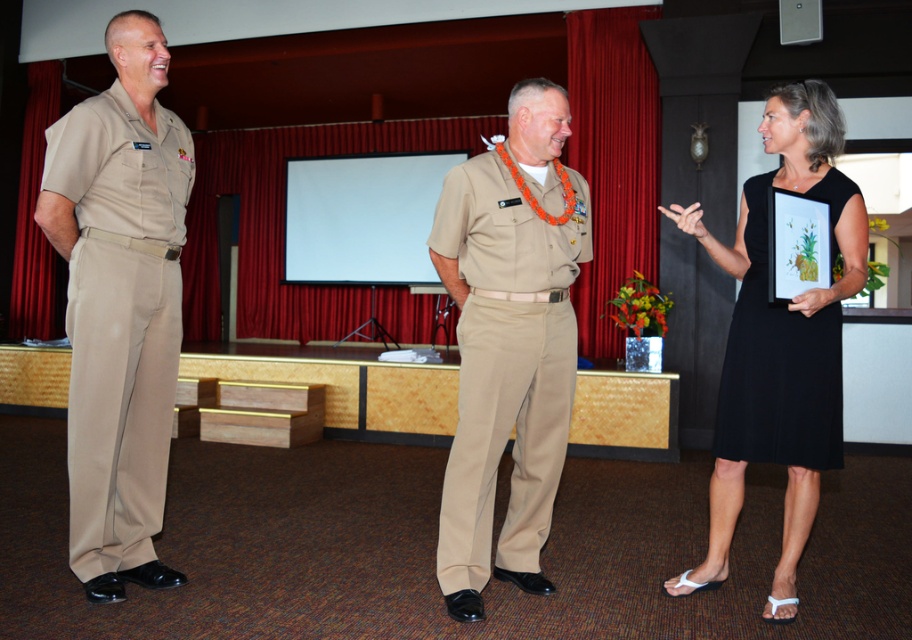
Question: Does tan cotton pants at left appear over black satin dress at right?

Choices:
 (A) yes
 (B) no

Answer: (B)

Question: Based on their relative distances, which object is nearer to the black fabric dress at upper right?

Choices:
 (A) tan/khaki uniform at center
 (B) tan cotton pants at left

Answer: (A)

Question: Does tan cotton pants at left appear under black fabric dress at upper right?

Choices:
 (A) no
 (B) yes

Answer: (A)

Question: Can you confirm if tan cotton pants at left is bigger than black fabric dress at upper right?

Choices:
 (A) yes
 (B) no

Answer: (B)

Question: Which object is farther from the camera taking this photo?

Choices:
 (A) tan/khaki uniform at center
 (B) black fabric dress at upper right

Answer: (A)

Question: Which point appears farthest from the camera in this image?

Choices:
 (A) (188, 189)
 (B) (705, 586)

Answer: (B)